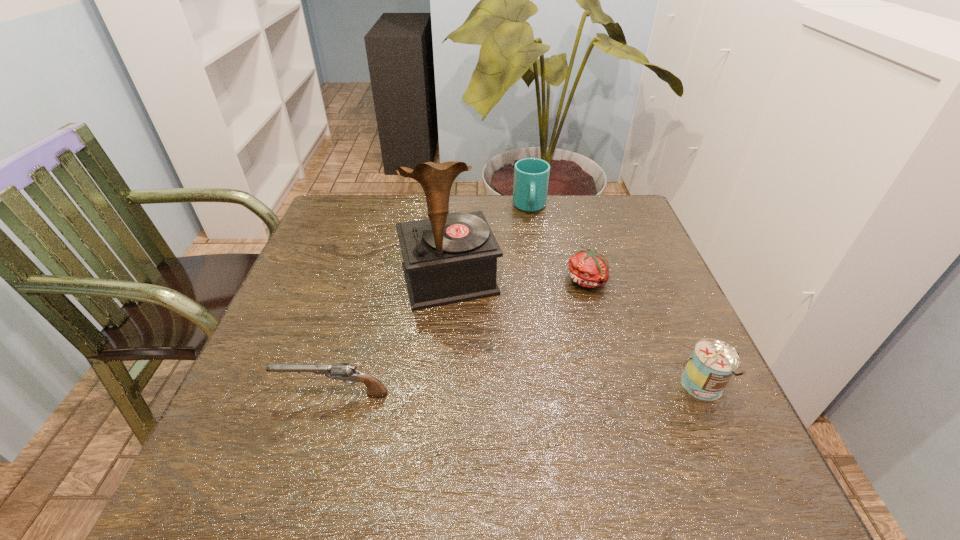
Find the location of `gun`. gun is located at coordinates (341, 371).

Locate an element on the screen. The image size is (960, 540). the rightmost object is located at coordinates (709, 369).

Locate an element on the screen. This screenshot has height=540, width=960. tomato is located at coordinates (588, 268).

Where is `the third object from left to right`? the third object from left to right is located at coordinates (531, 175).

Where is `the farthest object`? This screenshot has width=960, height=540. the farthest object is located at coordinates (531, 175).

Locate an element on the screen. the tallest object is located at coordinates (449, 258).

I want to click on vacant position located aiming along the barrel of the gun, so click(x=242, y=394).

I want to click on vacant region located on the back of the rightmost object, so click(670, 318).

Locate an element on the screen. vacant space located on the front-facing side of the fourth object from left to right is located at coordinates (569, 354).

At what (x,y) coordinates should I click in order to perform the action: click on free space located on the front-facing side of the fourth object from left to right. Please return your answer as a coordinate pair (x, y). The width and height of the screenshot is (960, 540). Looking at the image, I should click on (564, 377).